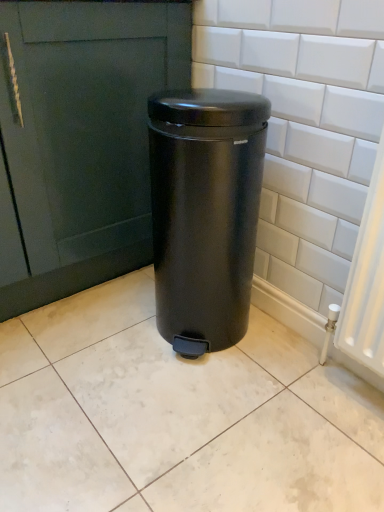
Identify the location of free space in front of matte black trash can at center. The height and width of the screenshot is (512, 384). (205, 401).